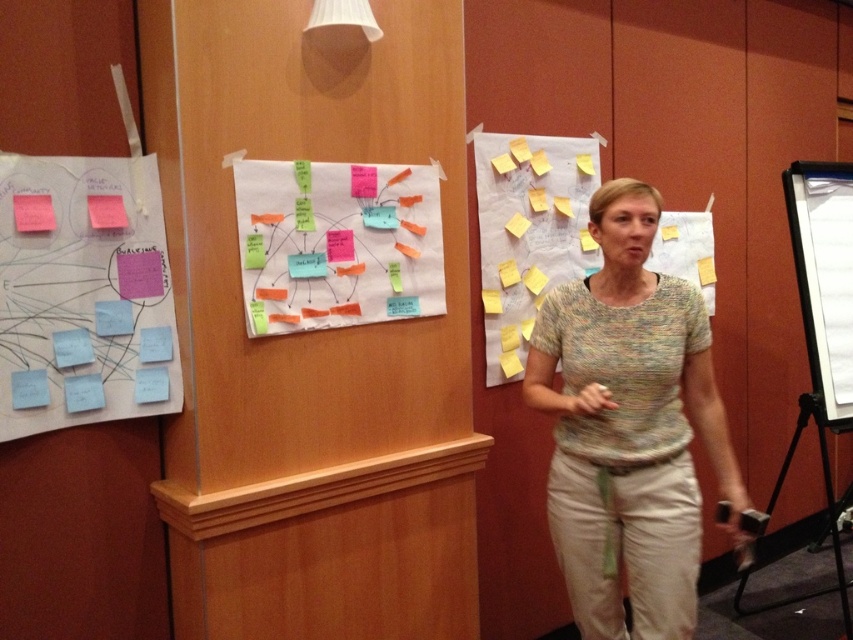
You are an interior designer assessing the room layout. The multicolored knit sweater at center and the blue matte sticky notes at left are both on the wall. Which object takes up more horizontal space on the wall?

The multicolored knit sweater at center takes up more horizontal space on the wall because its width is larger than that of the blue matte sticky notes at left.

What is the color of the sticky note that the point at coordinate (83,292) is located on?

The point at coordinate (83,292) is on blue matte sticky notes at left.

You are an architect in the room and want to place a new sticky note on the wall exactly at the coordinates given for the blue matte sticky notes at left. What are the coordinates you should use?

The coordinates for the blue matte sticky notes at left are at point (83,292).